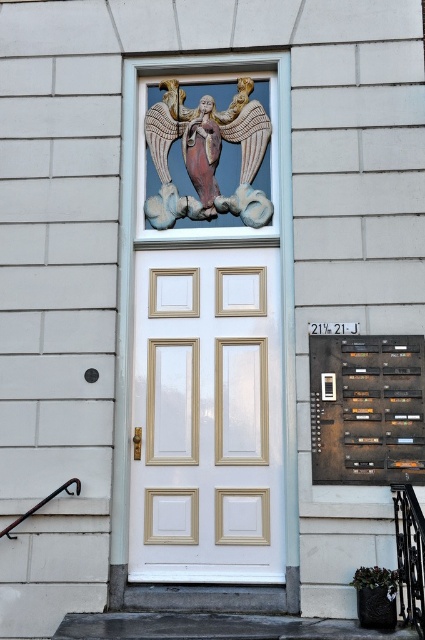
You are standing in front of the building and want to take a photo of the polychrome stone angel at upper center and the black wrought iron balustrade at lower right. Which object should you position to the right side of your camera frame?

The black wrought iron balustrade at lower right should be positioned to the right side of your camera frame because the polychrome stone angel at upper center is to the left of it.

You are standing in front of the building and want to enter through the door. Based on the coordinates provided in the description, is the white painted wood door at center positioned to your left or right side?

The white painted wood door at center is located at coordinates point (206, 417), which places it directly in front of you, so it is neither to your left nor right side but centered.

You are a delivery person trying to deliver a package to the address. You see the white painted wood door at center and the dark brown wooden plaque at lower right. Which object is bigger?

The white painted wood door at center has a larger size compared to the dark brown wooden plaque at lower right, so the white painted wood door at center is bigger.